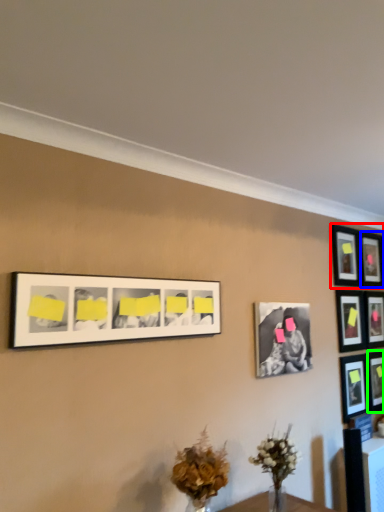
Question: Which is farther away from picture frame (highlighted by a red box)? picture frame (highlighted by a blue box) or picture frame (highlighted by a green box)?

Choices:
 (A) picture frame
 (B) picture frame

Answer: (B)